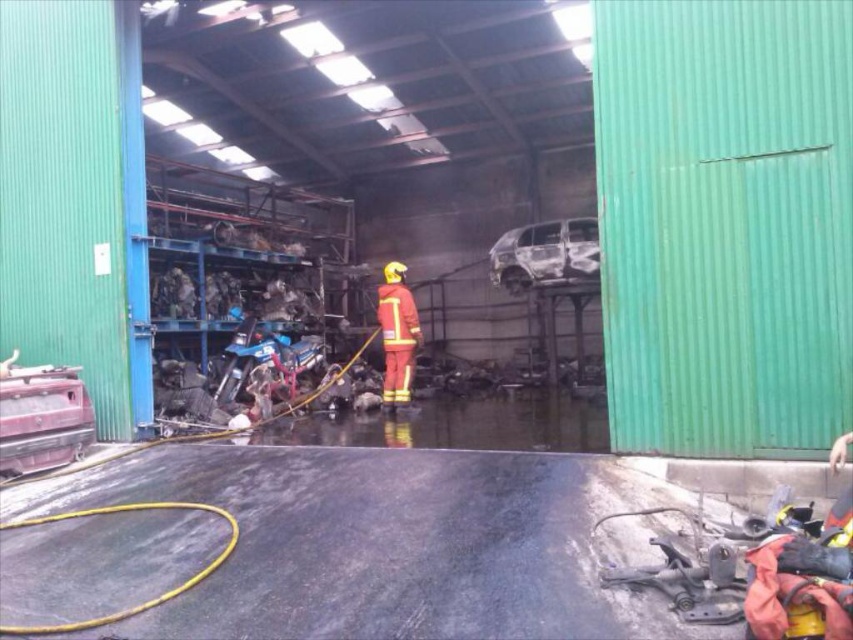
Question: Does burnt metallic car at center have a larger size compared to red matte fireman at center?

Choices:
 (A) yes
 (B) no

Answer: (A)

Question: Is burnt metallic car at center to the left of red matte fireman at center from the viewer's perspective?

Choices:
 (A) yes
 (B) no

Answer: (B)

Question: In this image, where is burnt metallic car at center located relative to red matte fireman at center?

Choices:
 (A) right
 (B) left

Answer: (A)

Question: Which of the following is the closest to the observer?

Choices:
 (A) (409, 349)
 (B) (498, 280)

Answer: (A)